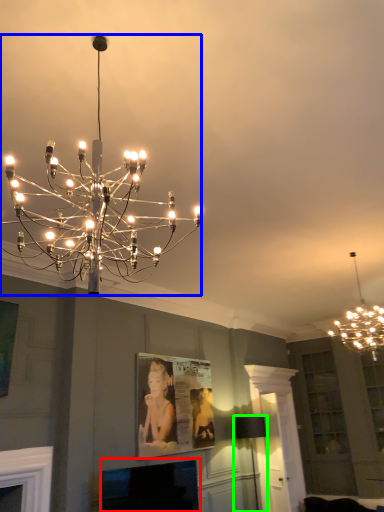
Question: Estimate the real-world distances between objects in this image. Which object is closer to fireplace (highlighted by a red box), lamp (highlighted by a blue box) or lamp (highlighted by a green box)?

Choices:
 (A) lamp
 (B) lamp

Answer: (B)